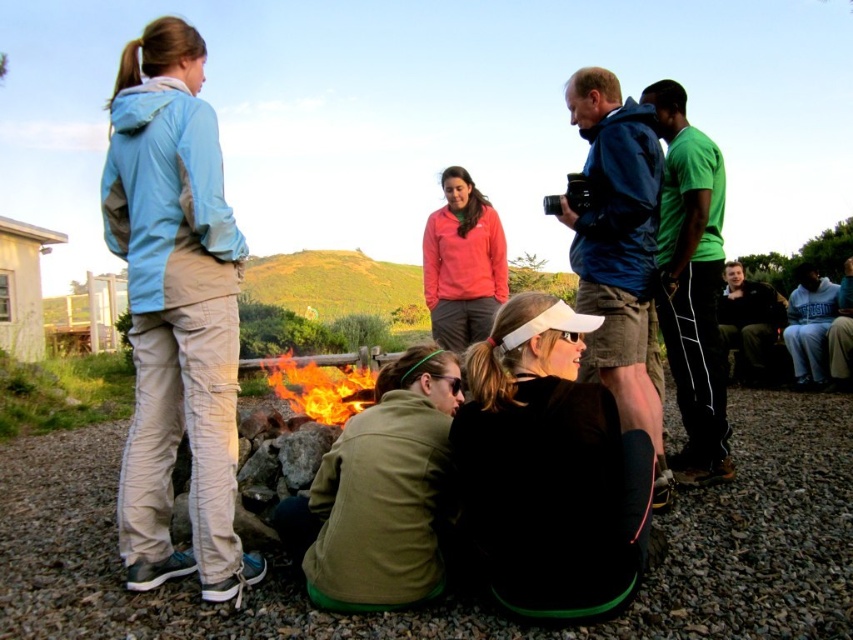
Is light blue fabric jacket at upper left wider than matte pink hoodie at center?

Correct, the width of light blue fabric jacket at upper left exceeds that of matte pink hoodie at center.

Does light blue fabric jacket at upper left have a larger size compared to matte pink hoodie at center?

Indeed, light blue fabric jacket at upper left has a larger size compared to matte pink hoodie at center.

The height and width of the screenshot is (640, 853). I want to click on light blue fabric jacket at upper left, so click(x=175, y=310).

Is black matte visor at center to the right of flaming wood at center from the viewer's perspective?

Indeed, black matte visor at center is positioned on the right side of flaming wood at center.

Which is in front, point (450, 426) or point (372, 392)?

Point (450, 426) is in front.

Who is more distant from viewer, (476, 435) or (291, 372)?

Point (291, 372)

The width and height of the screenshot is (853, 640). I want to click on black matte visor at center, so click(x=548, y=468).

Does black matte visor at center have a lesser height compared to matte pink hoodie at center?

Correct, black matte visor at center is not as tall as matte pink hoodie at center.

Is point (598, 589) positioned behind point (494, 257)?

No, it is in front of (494, 257).

The image size is (853, 640). In order to click on black matte visor at center in this screenshot , I will do `click(548, 468)`.

This screenshot has width=853, height=640. What are the coordinates of `black matte visor at center` in the screenshot? It's located at (548, 468).